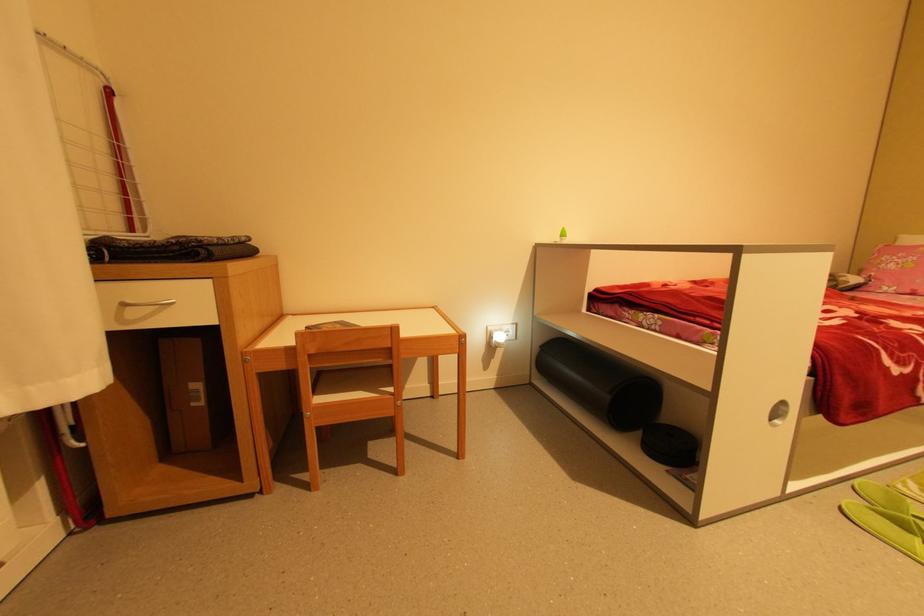
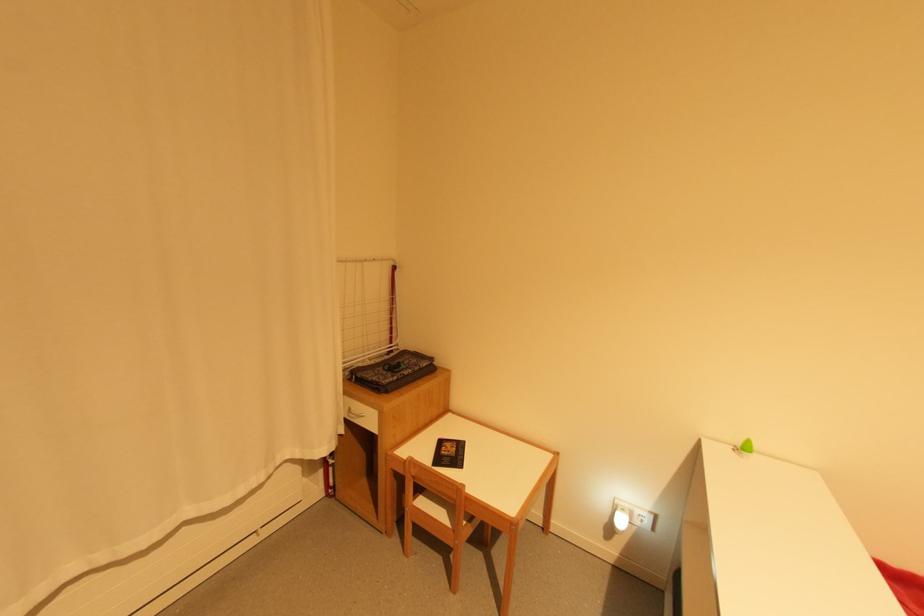
Question: The camera is either moving clockwise (left) or counter-clockwise (right) around the object. The first image is from the beginning of the video and the second image is from the end. Is the camera moving left or right when shooting the video?

Choices:
 (A) Left
 (B) Right

Answer: (B)